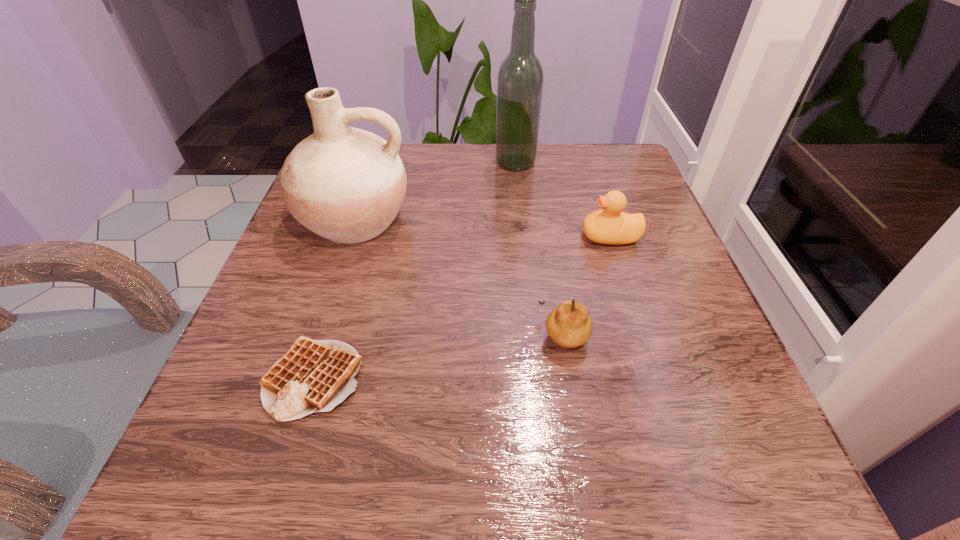
This screenshot has height=540, width=960. In order to click on the farthest object in this screenshot , I will do `click(520, 78)`.

Image resolution: width=960 pixels, height=540 pixels. What are the coordinates of `the tallest object` in the screenshot? It's located at (520, 78).

What are the coordinates of `the fourth shortest object` in the screenshot? It's located at (345, 184).

Locate an element on the screen. duck is located at coordinates (610, 225).

This screenshot has width=960, height=540. Find the location of `pear`. pear is located at coordinates (569, 324).

The height and width of the screenshot is (540, 960). I want to click on the shortest object, so click(x=313, y=376).

At what (x,y) coordinates should I click in order to perform the action: click on blank area located 0.310m on the left of the liquor. Please return your answer as a coordinate pair (x, y). This screenshot has width=960, height=540. Looking at the image, I should click on (367, 163).

Where is `free location located to pour from the handle of the fourth shortest object`? The height and width of the screenshot is (540, 960). free location located to pour from the handle of the fourth shortest object is located at coordinates (331, 289).

I want to click on vacant area situated 0.140m on the face of the duck, so click(511, 237).

The image size is (960, 540). I want to click on vacant space located 0.100m on the face of the duck, so click(531, 237).